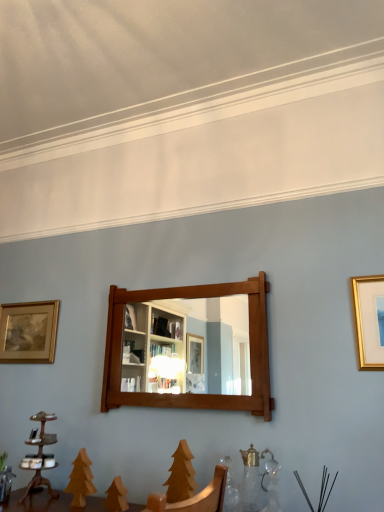
What are the coordinates of `mahogany wooden mirror at center` in the screenshot? It's located at (187, 346).

Find the location of a particular element. mahogany wooden mirror at center is located at coordinates (187, 346).

Which object is thinner, wooden candle holder at lower left or mahogany wooden mirror at center?

mahogany wooden mirror at center is thinner.

Considering the sizes of objects wooden candle holder at lower left and mahogany wooden mirror at center in the image provided, who is taller, wooden candle holder at lower left or mahogany wooden mirror at center?

mahogany wooden mirror at center is taller.

Identify the location of candle holder located below the mahogany wooden mirror at center (from the image's perspective). (40, 456).

Considering the positions of objects wooden candle holder at lower left and mahogany wooden mirror at center in the image provided, who is more to the right, wooden candle holder at lower left or mahogany wooden mirror at center?

mahogany wooden mirror at center.

Is gold-framed painting at left, which is the 1th picture frame in left-to-right order, in contact with gold metallic picture frame at upper right, the 1th picture frame in the right-to-left sequence?

gold-framed painting at left, which is the 1th picture frame in left-to-right order, and gold metallic picture frame at upper right, the 1th picture frame in the right-to-left sequence, are clearly separated.

Is gold-framed painting at left, which is the 1th picture frame in left-to-right order, oriented towards gold metallic picture frame at upper right, the 1th picture frame in the right-to-left sequence?

No, gold-framed painting at left, which is the 1th picture frame in left-to-right order, does not turn towards gold metallic picture frame at upper right, the 1th picture frame in the right-to-left sequence.

Considering the relative positions of gold-framed painting at left, which is the second picture frame from right to left, and gold metallic picture frame at upper right, arranged as the second picture frame when viewed from the left, in the image provided, is gold-framed painting at left, which is the second picture frame from right to left, to the left or to the right of gold metallic picture frame at upper right, arranged as the second picture frame when viewed from the left,?

gold-framed painting at left, which is the second picture frame from right to left, is positioned on gold metallic picture frame at upper right, arranged as the second picture frame when viewed from the left,'s left side.

Is gold-framed painting at left, which is the second picture frame from right to left, inside or outside of gold metallic picture frame at upper right, which appears as the first picture frame when viewed from the front?

The correct answer is: outside.

Would you say gold metallic picture frame at upper right, which appears as the first picture frame when viewed from the front, is inside or outside gold-framed painting at left, which is the 1th picture frame in left-to-right order?

gold metallic picture frame at upper right, which appears as the first picture frame when viewed from the front, is not enclosed by gold-framed painting at left, which is the 1th picture frame in left-to-right order.

In terms of width, does gold metallic picture frame at upper right, the 1th picture frame in the right-to-left sequence, look wider or thinner when compared to gold-framed painting at left, which is the second picture frame from right to left?

Considering their sizes, gold metallic picture frame at upper right, the 1th picture frame in the right-to-left sequence, looks slimmer than gold-framed painting at left, which is the second picture frame from right to left.

Who is more distant, gold metallic picture frame at upper right, the 1th picture frame in the right-to-left sequence, or gold-framed painting at left, which is the 1th picture frame in left-to-right order?

gold-framed painting at left, which is the 1th picture frame in left-to-right order, is more distant.

Is gold metallic picture frame at upper right, acting as the 2th picture frame starting from the back, facing away from gold-framed painting at left, which is the second picture frame from right to left?

No, gold metallic picture frame at upper right, acting as the 2th picture frame starting from the back,'s orientation is not away from gold-framed painting at left, which is the second picture frame from right to left.

From a real-world perspective, which object rests below the other?

mahogany wooden mirror at center.

Who is smaller, gold metallic picture frame at upper right, which appears as the first picture frame when viewed from the front, or mahogany wooden mirror at center?

gold metallic picture frame at upper right, which appears as the first picture frame when viewed from the front.

How different are the orientations of gold metallic picture frame at upper right, arranged as the second picture frame when viewed from the left, and mahogany wooden mirror at center in degrees?

They differ by 0.43 degrees in their facing directions.

Which object is closer to the camera taking this photo, gold-framed painting at left, which is the 1th picture frame in left-to-right order, or mahogany wooden mirror at center?

Positioned in front is mahogany wooden mirror at center.

Where is `mirror above the gold-framed painting at left, marked as the second picture frame in a front-to-back arrangement (from the image's perspective)`? Image resolution: width=384 pixels, height=512 pixels. mirror above the gold-framed painting at left, marked as the second picture frame in a front-to-back arrangement (from the image's perspective) is located at coordinates (187, 346).

Is gold-framed painting at left, which is the 1th picture frame in left-to-right order, directly adjacent to mahogany wooden mirror at center?

No, gold-framed painting at left, which is the 1th picture frame in left-to-right order, is not next to mahogany wooden mirror at center.

From the picture: Are mahogany wooden mirror at center and gold metallic picture frame at upper right, arranged as the second picture frame when viewed from the left, located far from each other?

That's not correct — mahogany wooden mirror at center is a little close to gold metallic picture frame at upper right, arranged as the second picture frame when viewed from the left.

From the image's perspective, which object appears higher, mahogany wooden mirror at center or gold metallic picture frame at upper right, acting as the 2th picture frame starting from the back?

gold metallic picture frame at upper right, acting as the 2th picture frame starting from the back, appears higher in the image.

Could you measure the distance between mahogany wooden mirror at center and gold metallic picture frame at upper right, the 1th picture frame in the right-to-left sequence?

mahogany wooden mirror at center is 68.88 centimeters away from gold metallic picture frame at upper right, the 1th picture frame in the right-to-left sequence.

Considering the relative sizes of mahogany wooden mirror at center and gold metallic picture frame at upper right, the 1th picture frame in the right-to-left sequence, in the image provided, is mahogany wooden mirror at center thinner than gold metallic picture frame at upper right, the 1th picture frame in the right-to-left sequence,?

No, mahogany wooden mirror at center is not thinner than gold metallic picture frame at upper right, the 1th picture frame in the right-to-left sequence.

Is wooden candle holder at lower left behind gold-framed painting at left, which is the second picture frame from right to left?

No, wooden candle holder at lower left is in front of gold-framed painting at left, which is the second picture frame from right to left.

From the image's perspective, is wooden candle holder at lower left beneath gold-framed painting at left, marked as the second picture frame in a front-to-back arrangement?

Yes, from the image's perspective, wooden candle holder at lower left is below gold-framed painting at left, marked as the second picture frame in a front-to-back arrangement.

Between wooden candle holder at lower left and gold-framed painting at left, which is the 1th picture frame in left-to-right order, which one appears on the right side from the viewer's perspective?

From the viewer's perspective, wooden candle holder at lower left appears more on the right side.

The image size is (384, 512). What are the coordinates of `mirror on the right of the wooden candle holder at lower left` in the screenshot? It's located at coord(187,346).

Locate an element on the screen. This screenshot has height=512, width=384. picture frame that is on the left side of gold metallic picture frame at upper right, the 1th picture frame in the right-to-left sequence is located at coordinates (28, 332).

Which object lies further to the anchor point gold-framed painting at left, which is the 1th picture frame in left-to-right order, wooden candle holder at lower left or mahogany wooden mirror at center?

mahogany wooden mirror at center lies further to gold-framed painting at left, which is the 1th picture frame in left-to-right order, than the other object.

Looking at the image, which one is located closer to wooden candle holder at lower left, mahogany wooden mirror at center or gold-framed painting at left, which is the second picture frame from right to left?

Based on the image, gold-framed painting at left, which is the second picture frame from right to left, appears to be nearer to wooden candle holder at lower left.

Which object lies nearer to the anchor point gold metallic picture frame at upper right, acting as the 2th picture frame starting from the back, mahogany wooden mirror at center or wooden candle holder at lower left?

mahogany wooden mirror at center is positioned closer to the anchor gold metallic picture frame at upper right, acting as the 2th picture frame starting from the back.

Based on the photo, based on their spatial positions, is gold metallic picture frame at upper right, arranged as the second picture frame when viewed from the left, or mahogany wooden mirror at center further from wooden candle holder at lower left?

gold metallic picture frame at upper right, arranged as the second picture frame when viewed from the left, lies further to wooden candle holder at lower left than the other object.

Considering their positions, is gold-framed painting at left, which is the second picture frame from right to left, positioned closer to mahogany wooden mirror at center than gold metallic picture frame at upper right, acting as the 2th picture frame starting from the back?

gold metallic picture frame at upper right, acting as the 2th picture frame starting from the back, lies closer to mahogany wooden mirror at center than the other object.

Based on their spatial positions, is wooden candle holder at lower left or mahogany wooden mirror at center closer to gold metallic picture frame at upper right, which appears as the first picture frame when viewed from the front?

Based on the image, mahogany wooden mirror at center appears to be nearer to gold metallic picture frame at upper right, which appears as the first picture frame when viewed from the front.

Based on the photo, looking at the image, which one is located further to mahogany wooden mirror at center, gold metallic picture frame at upper right, acting as the 2th picture frame starting from the back, or gold-framed painting at left, which is the 1th picture frame in left-to-right order?

The object further to mahogany wooden mirror at center is gold-framed painting at left, which is the 1th picture frame in left-to-right order.

Looking at the image, which one is located further to mahogany wooden mirror at center, wooden candle holder at lower left or gold metallic picture frame at upper right, arranged as the second picture frame when viewed from the left?

wooden candle holder at lower left is positioned further to the anchor mahogany wooden mirror at center.

Identify the location of mirror located between gold-framed painting at left, which is the 1th picture frame in left-to-right order, and gold metallic picture frame at upper right, the 1th picture frame in the right-to-left sequence, in the left-right direction. (187, 346).

Locate an element on the screen. mirror between wooden candle holder at lower left and gold metallic picture frame at upper right, which appears as the first picture frame when viewed from the front is located at coordinates (187, 346).

I want to click on candle holder between gold-framed painting at left, which is the second picture frame from right to left, and mahogany wooden mirror at center, in the horizontal direction, so click(x=40, y=456).

This screenshot has height=512, width=384. Identify the location of candle holder located between gold-framed painting at left, marked as the second picture frame in a front-to-back arrangement, and gold metallic picture frame at upper right, arranged as the second picture frame when viewed from the left, in the left-right direction. (40, 456).